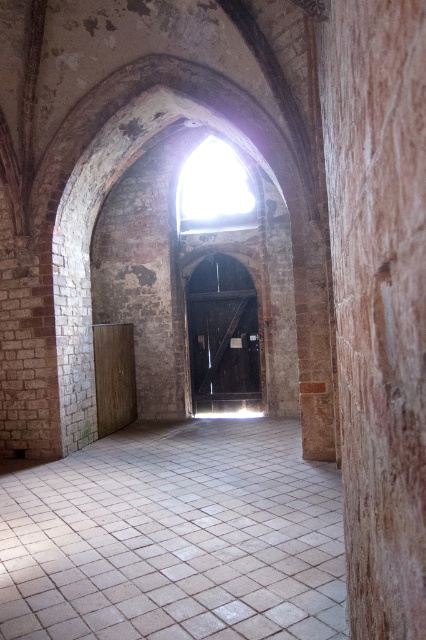
Question: Is white tile floor at center positioned behind brown polished wood pillar at right?

Choices:
 (A) no
 (B) yes

Answer: (B)

Question: Is white tile floor at center smaller than brown polished wood pillar at right?

Choices:
 (A) yes
 (B) no

Answer: (A)

Question: Which point appears closest to the camera in this image?

Choices:
 (A) (189, 502)
 (B) (420, 195)

Answer: (B)

Question: Which object is closer to the camera taking this photo?

Choices:
 (A) white tile floor at center
 (B) brown polished wood pillar at right

Answer: (B)

Question: Which object appears closest to the camera in this image?

Choices:
 (A) white tile floor at center
 (B) brown polished wood pillar at right

Answer: (B)

Question: Is white tile floor at center to the left of brown polished wood pillar at right from the viewer's perspective?

Choices:
 (A) yes
 (B) no

Answer: (A)